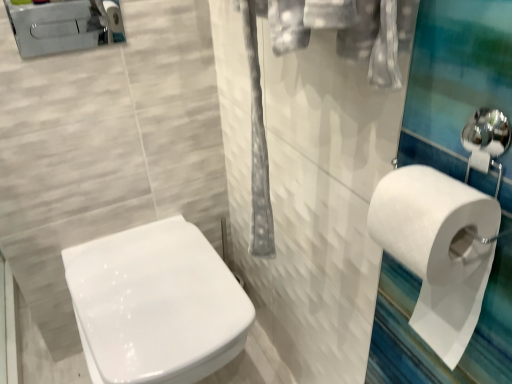
Question: In terms of size, does brushed metal toilet at upper left appear bigger or smaller than white glossy toilet at center?

Choices:
 (A) big
 (B) small

Answer: (B)

Question: Is brushed metal toilet at upper left to the left or to the right of white glossy toilet at center in the image?

Choices:
 (A) right
 (B) left

Answer: (B)

Question: Which object is positioned farthest from the white matte toilet paper at right?

Choices:
 (A) brushed metal toilet at upper left
 (B) white glossy toilet at center

Answer: (A)

Question: Which object is the farthest from the brushed metal toilet at upper left?

Choices:
 (A) white glossy toilet at center
 (B) white matte toilet paper at right

Answer: (B)